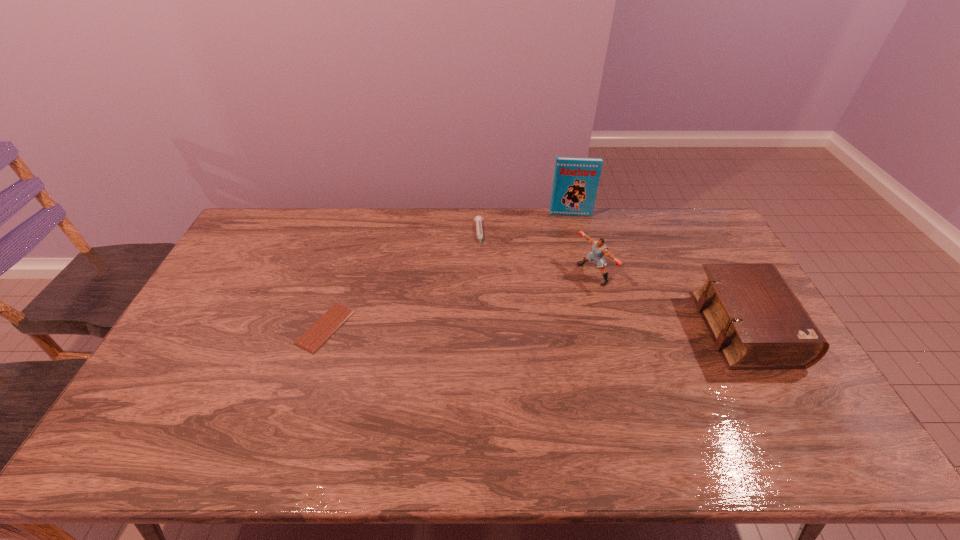
Locate an element on the screen. free space that satisfies the following two spatial constraints: 1. on the front side of the rightmost object; 2. on the spine side of the puncher is located at coordinates (608, 328).

Where is `vacant region that satisfies the following two spatial constraints: 1. on the front side of the tallest object; 2. on the spine side of the rightmost object`? vacant region that satisfies the following two spatial constraints: 1. on the front side of the tallest object; 2. on the spine side of the rightmost object is located at coordinates (599, 328).

Where is `vacant region that satisfies the following two spatial constraints: 1. on the front side of the third farthest object; 2. on the spine side of the rightmost object`? The width and height of the screenshot is (960, 540). vacant region that satisfies the following two spatial constraints: 1. on the front side of the third farthest object; 2. on the spine side of the rightmost object is located at coordinates (608, 328).

This screenshot has height=540, width=960. Find the location of `free point that satisfies the following two spatial constraints: 1. on the front side of the third nearest object; 2. on the right side of the farthest object`. free point that satisfies the following two spatial constraints: 1. on the front side of the third nearest object; 2. on the right side of the farthest object is located at coordinates 586,273.